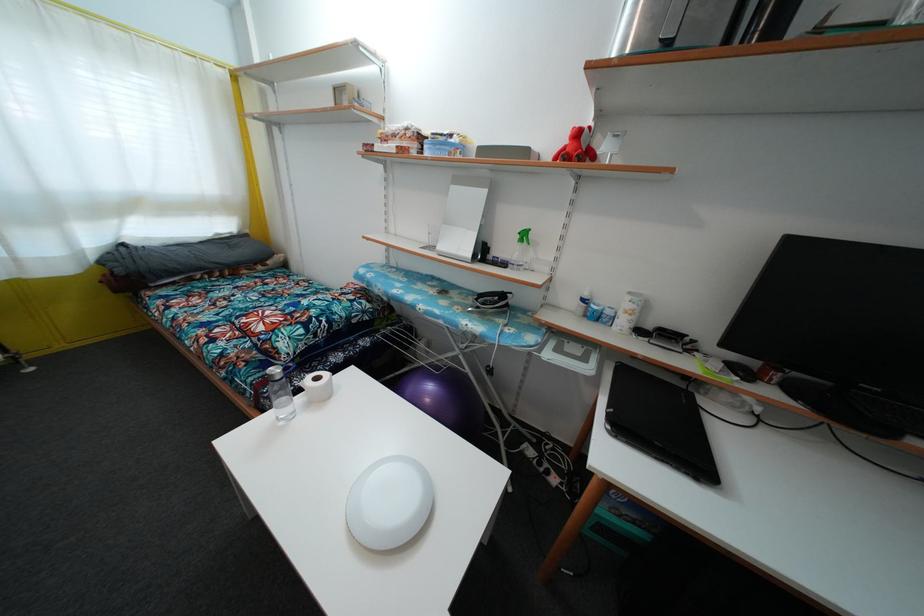
Find where to press the black stapler. Please return your answer as a coordinate pair (x, y).

(672, 339)